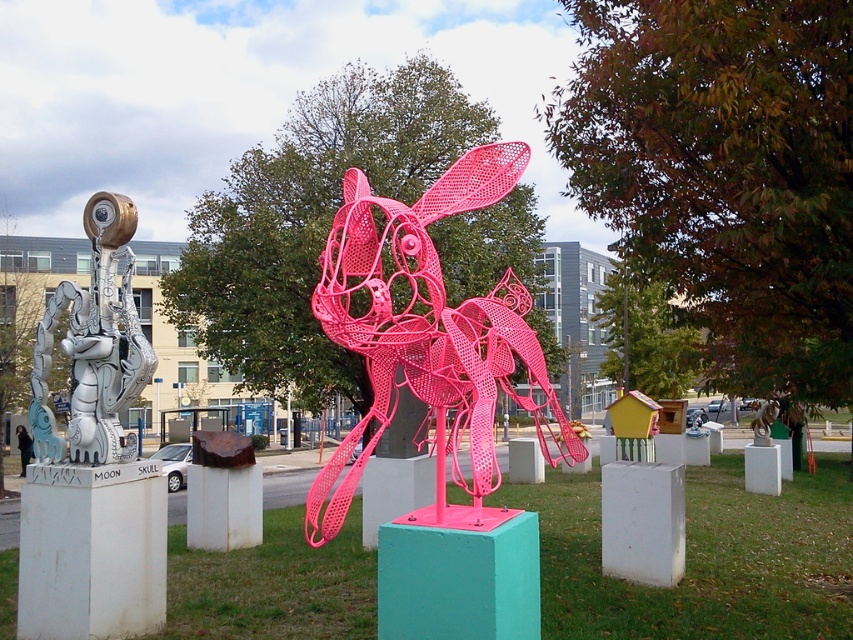
Which of these two, pink wireframe dog at center or brushed metal sphere at left, stands shorter?

pink wireframe dog at center

How far apart are pink wireframe dog at center and brushed metal sphere at left?

A distance of 7.26 feet exists between pink wireframe dog at center and brushed metal sphere at left.

At what (x,y) coordinates should I click in order to perform the action: click on pink wireframe dog at center. Please return your answer as a coordinate pair (x, y). This screenshot has height=640, width=853. Looking at the image, I should click on (428, 339).

Identify the location of pink wireframe dog at center. The image size is (853, 640). (428, 339).

Between pink wireframe rabbit at center and brushed metal sphere at left, which one appears on the right side from the viewer's perspective?

Positioned to the right is pink wireframe rabbit at center.

Between point (706, 500) and point (76, 337), which one is positioned in front?

Point (76, 337)

Locate an element on the screen. The width and height of the screenshot is (853, 640). pink wireframe rabbit at center is located at coordinates (703, 557).

Which is more to the right, pink wireframe rabbit at center or pink wireframe dog at center?

Positioned to the right is pink wireframe rabbit at center.

Image resolution: width=853 pixels, height=640 pixels. What are the coordinates of `pink wireframe rabbit at center` in the screenshot? It's located at (703, 557).

At what (x,y) coordinates should I click in order to perform the action: click on pink wireframe rabbit at center. Please return your answer as a coordinate pair (x, y). Looking at the image, I should click on (703, 557).